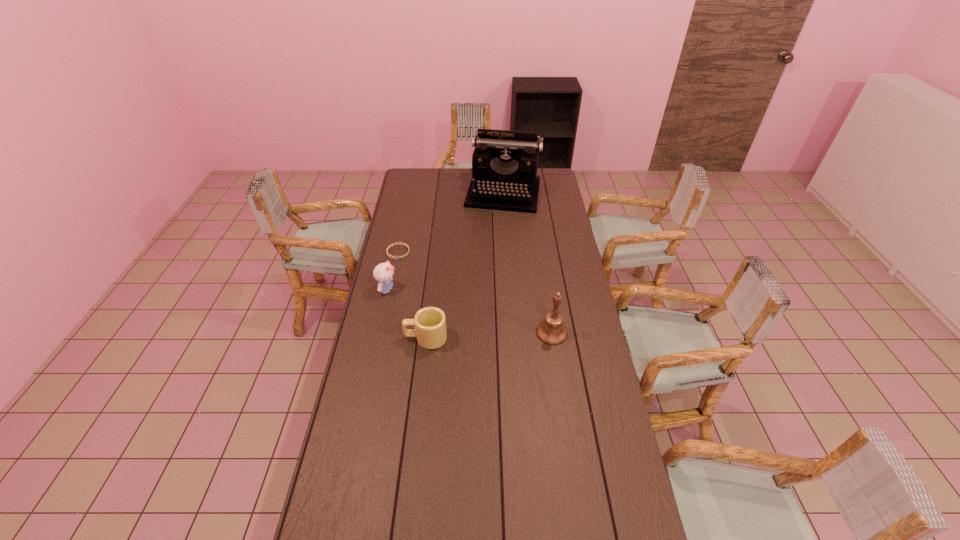
Find the location of a particular element. This screenshot has height=540, width=960. vacant point located on the surface of the fourth nearest object showing star-shaped elements is located at coordinates (414, 264).

The height and width of the screenshot is (540, 960). What are the coordinates of `free space located 0.160m on the surface of the fourth nearest object showing star-shaped elements` in the screenshot? It's located at (426, 273).

I want to click on object situated at the far edge, so click(504, 163).

You are a GUI agent. You are given a task and a screenshot of the screen. Output one action in this format:
    pyautogui.click(x=<x>, y=<y>)
    Task: Click on the mug located in the left edge section of the desktop
    This screenshot has height=540, width=960.
    Given the screenshot: What is the action you would take?
    pyautogui.click(x=430, y=331)

The width and height of the screenshot is (960, 540). In order to click on kitten present at the left edge in this screenshot , I will do `click(383, 273)`.

The height and width of the screenshot is (540, 960). Find the location of `bracelet that is at the left edge`. bracelet that is at the left edge is located at coordinates (406, 254).

Locate an element on the screen. bell that is at the right edge is located at coordinates (551, 331).

Identify the location of typewriter that is positioned at the right edge. (504, 163).

This screenshot has width=960, height=540. In order to click on object that is at the far right corner in this screenshot , I will do `click(504, 163)`.

Image resolution: width=960 pixels, height=540 pixels. I want to click on vacant space at the near edge of the desktop, so click(x=563, y=525).